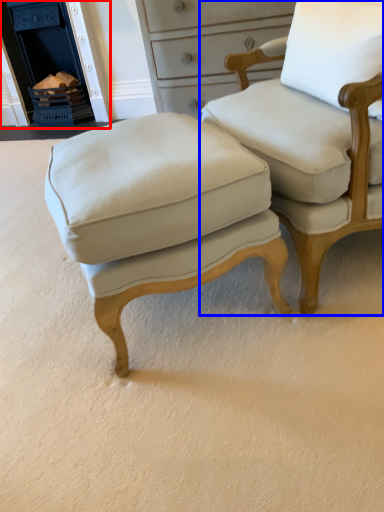
Question: Among these objects, which one is nearest to the camera, fireplace (highlighted by a red box) or chair (highlighted by a blue box)?

Choices:
 (A) fireplace
 (B) chair

Answer: (B)